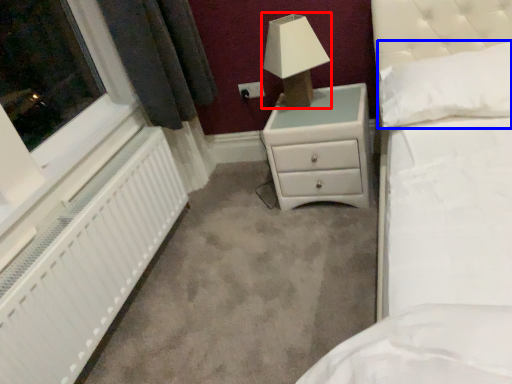
Question: Which of the following is the closest to the observer, lamp (highlighted by a red box) or pillow (highlighted by a blue box)?

Choices:
 (A) lamp
 (B) pillow

Answer: (B)